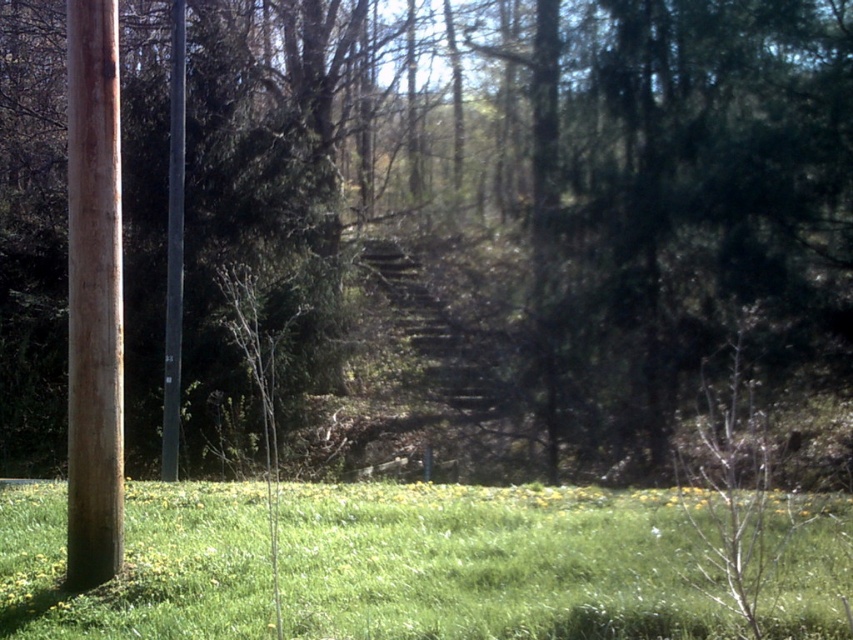
You are standing in the outdoor scene and see the brown wood pole at left and the black smooth pole at left. Which pole is closer to the right side of the scene?

The brown wood pole at left is positioned on the right side of black smooth pole at left, so it is closer to the right side of the scene.